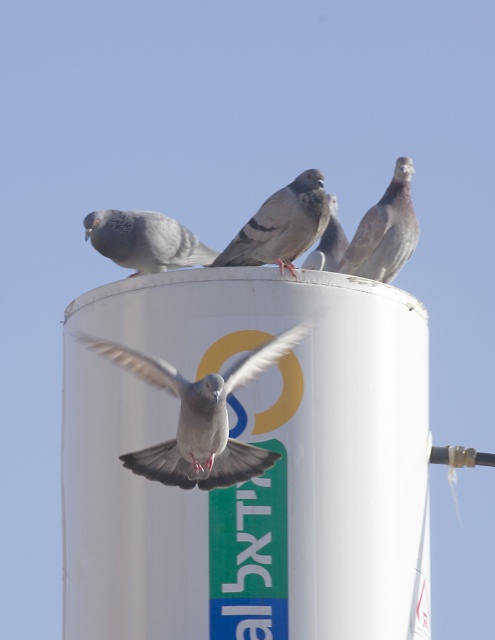
Question: Is gray matte bird at center bigger than gray matte pigeon at center?

Choices:
 (A) no
 (B) yes

Answer: (A)

Question: Considering the relative positions of gray matte pigeon at upper left and gray matte pigeon at center in the image provided, where is gray matte pigeon at upper left located with respect to gray matte pigeon at center?

Choices:
 (A) above
 (B) below

Answer: (A)

Question: Which of the following is the closest to the observer?

Choices:
 (A) gray matte bird at center
 (B) rusty feathered pigeon at upper right
 (C) gray matte pigeon at upper left
 (D) gray feathered pigeon at center

Answer: (A)

Question: Is gray matte pigeon at upper left bigger than gray matte pigeon at center?

Choices:
 (A) yes
 (B) no

Answer: (A)

Question: Which of these objects is positioned closest to the rusty feathered pigeon at upper right?

Choices:
 (A) gray matte pigeon at upper left
 (B) gray matte pigeon at center
 (C) gray matte bird at center

Answer: (B)

Question: Which of the following is the farthest from the observer?

Choices:
 (A) (368, 257)
 (B) (291, 262)
 (C) (247, 356)
 (D) (204, 248)

Answer: (D)